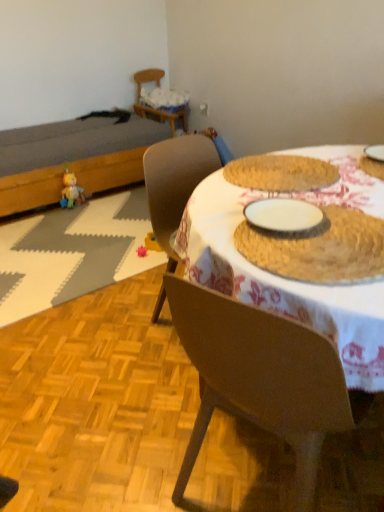
Where is `vacant area that lies between plush yellow duck at left, the 2th toy when ordered from bottom to top, and pink fabric toy at lower center, arranged as the first toy when viewed from the right`? This screenshot has height=512, width=384. vacant area that lies between plush yellow duck at left, the 2th toy when ordered from bottom to top, and pink fabric toy at lower center, arranged as the first toy when viewed from the right is located at coordinates (105, 227).